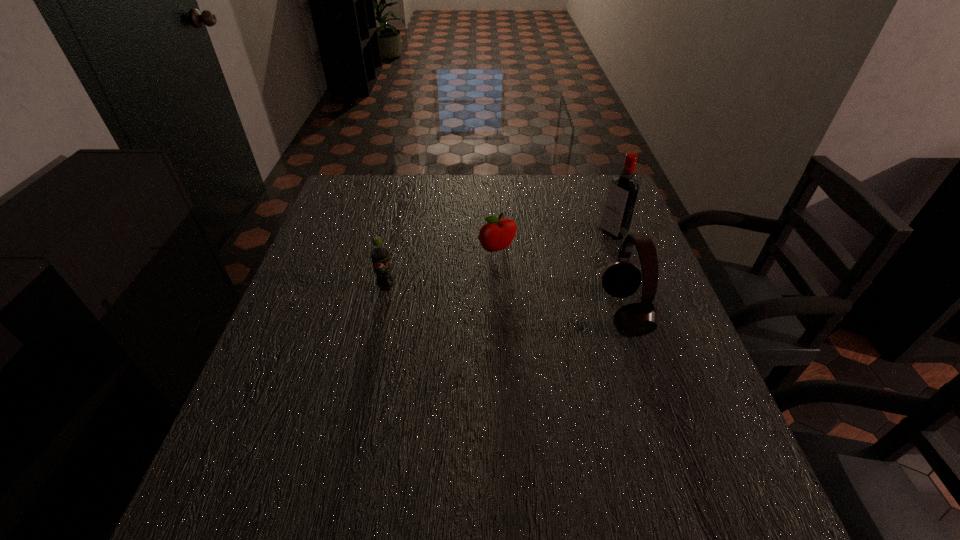
This screenshot has height=540, width=960. In order to click on free space that is in between the soda and the farthest object in this screenshot , I will do `click(499, 261)`.

This screenshot has width=960, height=540. In order to click on vacant point located between the apple and the second shortest object in this screenshot , I will do `click(442, 269)`.

In order to click on free space between the third object from right to left and the soda in this screenshot , I will do `click(442, 269)`.

Locate an element on the screen. the second closest object to the third object from right to left is located at coordinates (379, 254).

Identify the location of object that ranks as the closest to the second shortest object. (497, 234).

Image resolution: width=960 pixels, height=540 pixels. I want to click on free space that satisfies the following two spatial constraints: 1. on the front label of the third shortest object; 2. on the ear pads of the second shortest object, so click(381, 312).

The image size is (960, 540). Find the location of `free spot that satisfies the following two spatial constraints: 1. on the front label of the leftmost object; 2. on the ear pads of the headset`. free spot that satisfies the following two spatial constraints: 1. on the front label of the leftmost object; 2. on the ear pads of the headset is located at coordinates [x=381, y=312].

Find the location of a particular element. Image resolution: width=960 pixels, height=540 pixels. free space that satisfies the following two spatial constraints: 1. on the front label of the headset; 2. on the ear pads of the soda is located at coordinates (381, 312).

Where is `free space that satisfies the following two spatial constraints: 1. on the front label of the leftmost object; 2. on the ear pads of the headset`? The image size is (960, 540). free space that satisfies the following two spatial constraints: 1. on the front label of the leftmost object; 2. on the ear pads of the headset is located at coordinates (381, 312).

Locate an element on the screen. This screenshot has height=540, width=960. vacant space that satisfies the following two spatial constraints: 1. on the front label of the leftmost object; 2. on the ear pads of the headset is located at coordinates (381, 312).